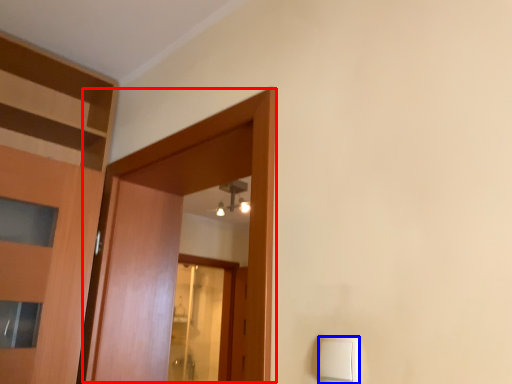
Question: Which point is further to the camera, door (highlighted by a red box) or light switch (highlighted by a blue box)?

Choices:
 (A) door
 (B) light switch

Answer: (A)